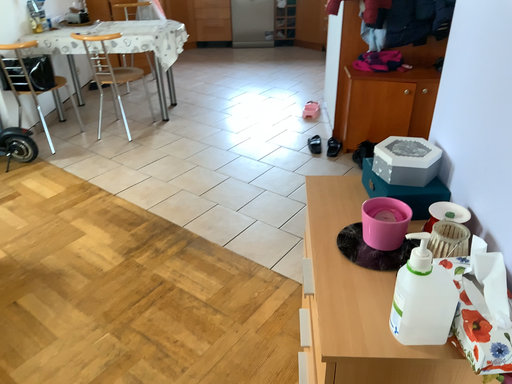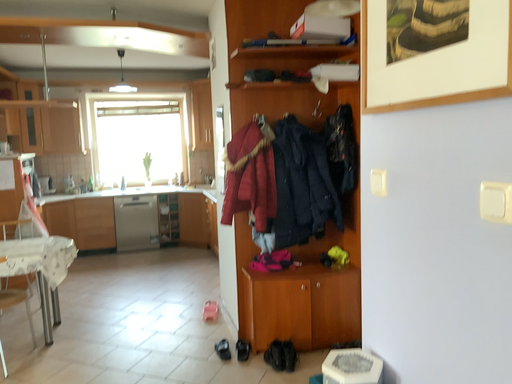
Question: Which way did the camera rotate in the video?

Choices:
 (A) rotated right
 (B) rotated left

Answer: (A)